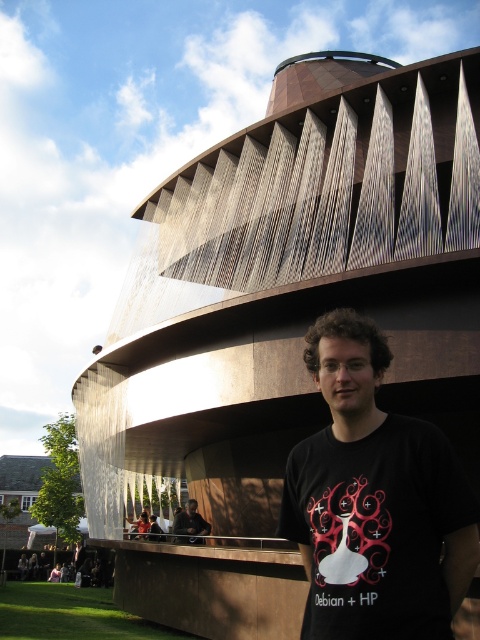
Is black matte t-shirt at center taller than dark brown leather jacket at lower center?

Indeed, black matte t-shirt at center has a greater height compared to dark brown leather jacket at lower center.

Is point (325, 620) in front of point (173, 522)?

Yes, it is in front of point (173, 522).

Locate an element on the screen. The height and width of the screenshot is (640, 480). black matte t-shirt at center is located at coordinates (374, 500).